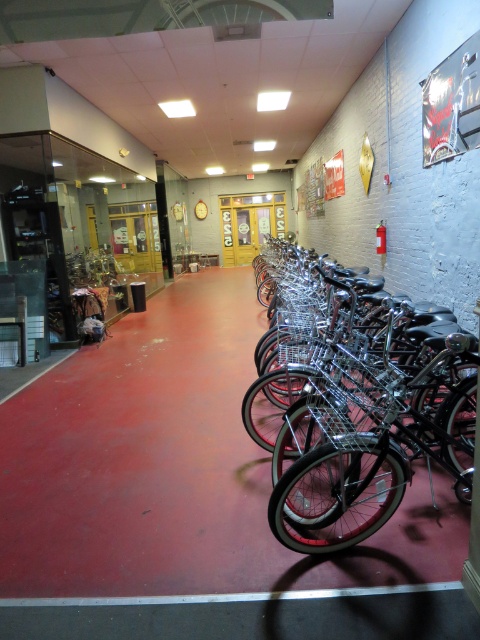
Question: Which point is closer to the camera?

Choices:
 (A) white glossy line at lower center
 (B) shiny black bicycle at right

Answer: (A)

Question: Is shiny black bicycle at right to the right of white glossy line at lower center from the viewer's perspective?

Choices:
 (A) no
 (B) yes

Answer: (B)

Question: Does shiny black bicycle at right appear over white glossy line at lower center?

Choices:
 (A) no
 (B) yes

Answer: (B)

Question: Which of the following is the closest to the observer?

Choices:
 (A) (268, 420)
 (B) (231, 600)

Answer: (B)

Question: Is shiny black bicycle at right positioned before white glossy line at lower center?

Choices:
 (A) no
 (B) yes

Answer: (A)

Question: Among these points, which one is nearest to the camera?

Choices:
 (A) (382, 484)
 (B) (326, 588)

Answer: (B)